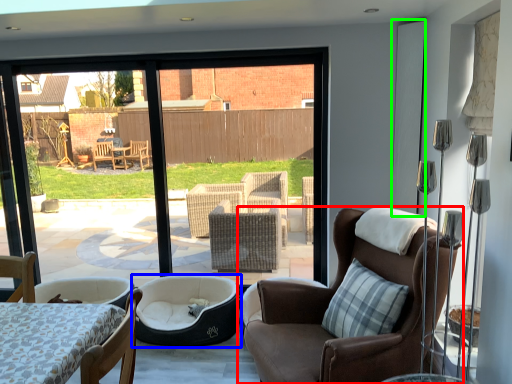
Question: Which is farther away from chair (highlighted by a red box)? dog bed (highlighted by a blue box) or screen door (highlighted by a green box)?

Choices:
 (A) dog bed
 (B) screen door

Answer: (B)